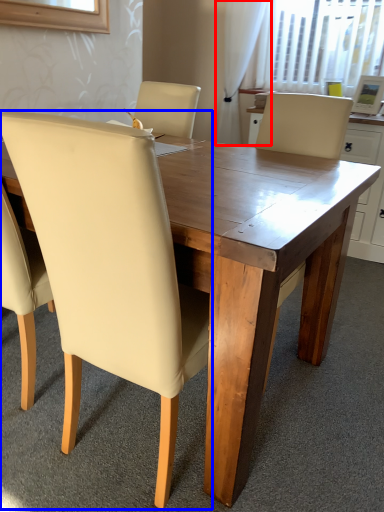
Question: Which of the following is the closest to the observer, curtain (highlighted by a red box) or chair (highlighted by a blue box)?

Choices:
 (A) curtain
 (B) chair

Answer: (B)